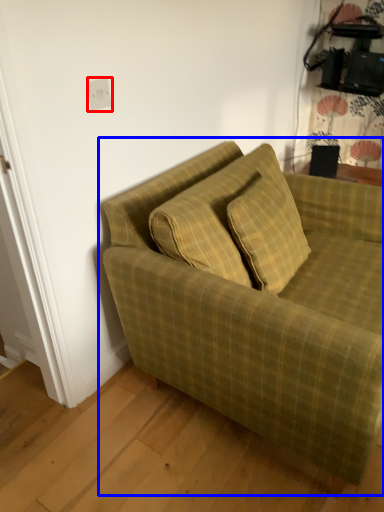
Question: Among these objects, which one is nearest to the camera, electric outlet (highlighted by a red box) or studio couch (highlighted by a blue box)?

Choices:
 (A) electric outlet
 (B) studio couch

Answer: (B)